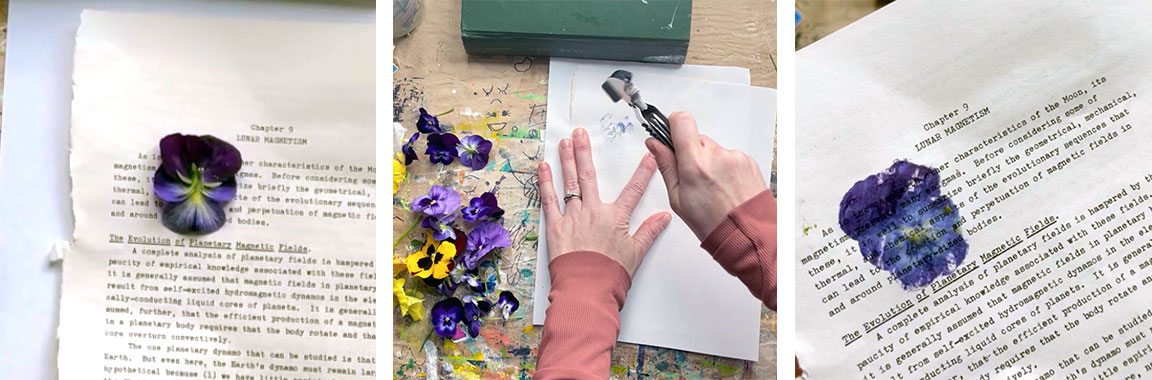
The width and height of the screenshot is (1152, 380). I want to click on box, so click(x=653, y=33).